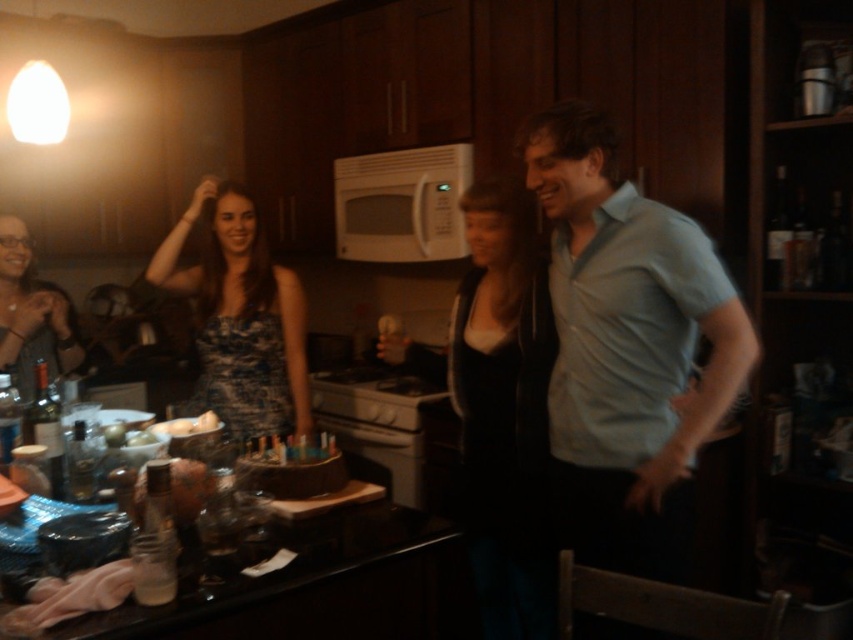
Question: Observing the image, what is the correct spatial positioning of light blue cotton shirt at right in reference to translucent glass bottle at left?

Choices:
 (A) above
 (B) below

Answer: (A)

Question: Which object is the farthest from the black leather jacket at center?

Choices:
 (A) white matte microwave at center
 (B) blue printed dress at center

Answer: (A)

Question: Is light blue cotton shirt at right further to the viewer compared to blue printed dress at center?

Choices:
 (A) yes
 (B) no

Answer: (B)

Question: Which point is farther from the camera taking this photo?

Choices:
 (A) (32, 408)
 (B) (235, 355)
 (C) (601, 380)

Answer: (B)

Question: Which object is closer to the camera taking this photo?

Choices:
 (A) black leather jacket at center
 (B) light blue cotton shirt at right
 (C) blue printed dress at center

Answer: (B)

Question: Is white matte microwave at center bigger than translucent glass bottle at left?

Choices:
 (A) yes
 (B) no

Answer: (A)